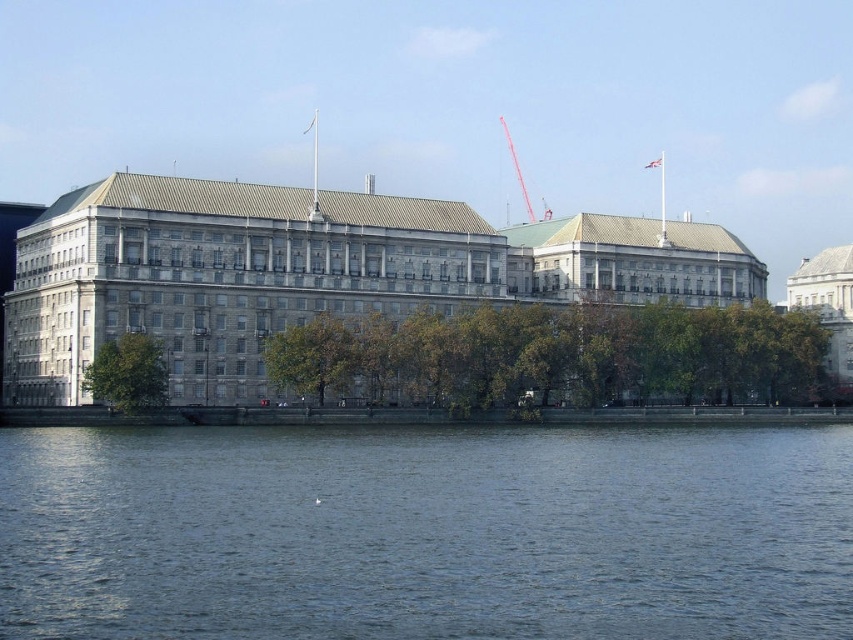
Is blue water at lower center smaller than gray stone building at center?

Yes.

The image size is (853, 640). Describe the element at coordinates (426, 532) in the screenshot. I see `blue water at lower center` at that location.

You are a GUI agent. You are given a task and a screenshot of the screen. Output one action in this format:
    pyautogui.click(x=<x>, y=<y>)
    Task: Click on the blue water at lower center
    
    Given the screenshot: What is the action you would take?
    pyautogui.click(x=426, y=532)